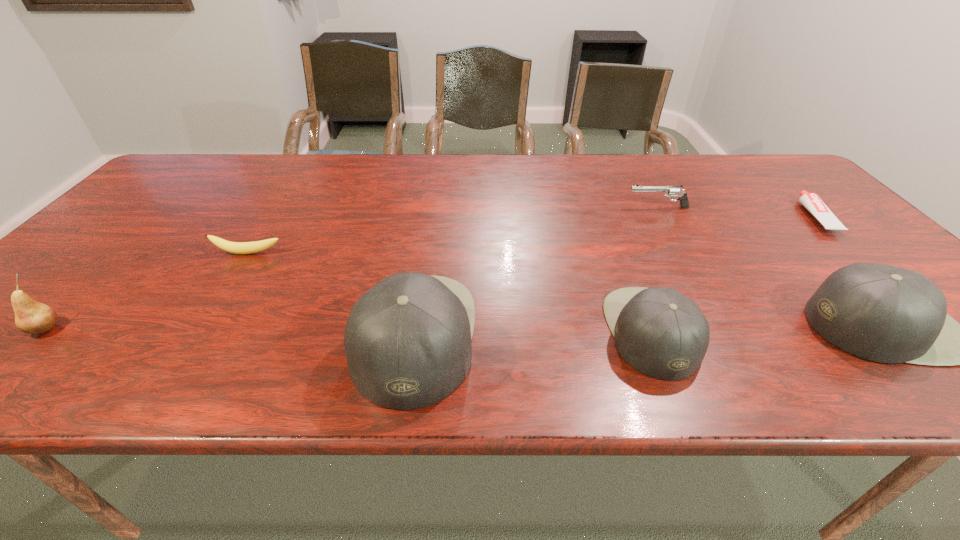
Choose which object is the second nearest neighbor to the fifth tallest object. Please provide its 2D coordinates. Your answer should be formatted as a tuple, i.e. [(x, y)], where the tuple contains the x and y coordinates of a point satisfying the conditions above.

[(658, 331)]

Where is `object that is the closest to the leftmost object`? The height and width of the screenshot is (540, 960). object that is the closest to the leftmost object is located at coordinates (232, 247).

This screenshot has height=540, width=960. I want to click on cap that can be found as the closest to the second tallest cap, so click(x=658, y=331).

The height and width of the screenshot is (540, 960). I want to click on the third closest cap to the pistol, so click(408, 340).

At what (x,y) coordinates should I click in order to perform the action: click on vacant point that satisfies the following two spatial constraints: 1. on the front-facing side of the fifth tallest object; 2. on the upward curve of the sixth tallest object. Please return your answer as a coordinate pair (x, y). Looking at the image, I should click on (684, 253).

Image resolution: width=960 pixels, height=540 pixels. I want to click on free space that satisfies the following two spatial constraints: 1. on the front side of the toothpaste; 2. on the brim of the fifth object from right to left, so click(938, 336).